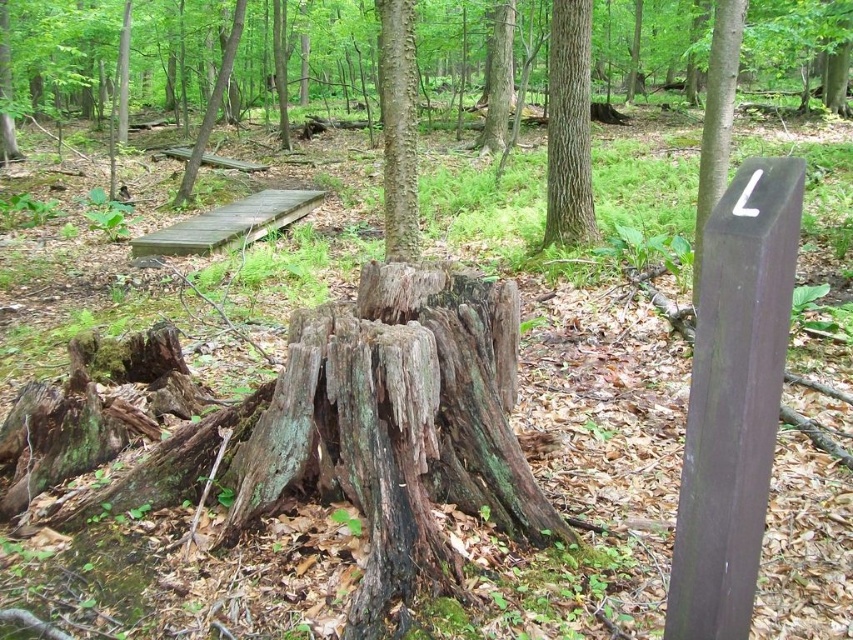
Between point (561, 241) and point (711, 99), which one is positioned behind?

The point (561, 241) is behind.

Is point (558, 227) closer to viewer compared to point (699, 269)?

That is False.

Measure the distance between point (552, 138) and camera.

The distance of point (552, 138) from camera is 5.60 meters.

This screenshot has width=853, height=640. I want to click on smooth brown tree trunk at upper center, so click(x=569, y=125).

Is rough bark tree trunk at center below brown rough wood post at upper right?

Incorrect, rough bark tree trunk at center is not positioned below brown rough wood post at upper right.

Does rough bark tree trunk at center appear on the left side of brown rough wood post at upper right?

Correct, you'll find rough bark tree trunk at center to the left of brown rough wood post at upper right.

In the scene shown: Who is more forward, (399, 172) or (708, 108)?

Point (708, 108) is more forward.

Find the location of `rough bark tree trunk at center`. rough bark tree trunk at center is located at coordinates (398, 128).

Is brown rough wood post at upper right below brown wooden plank at upper left?

Incorrect, brown rough wood post at upper right is not positioned below brown wooden plank at upper left.

The width and height of the screenshot is (853, 640). In order to click on brown rough wood post at upper right in this screenshot , I will do `click(717, 116)`.